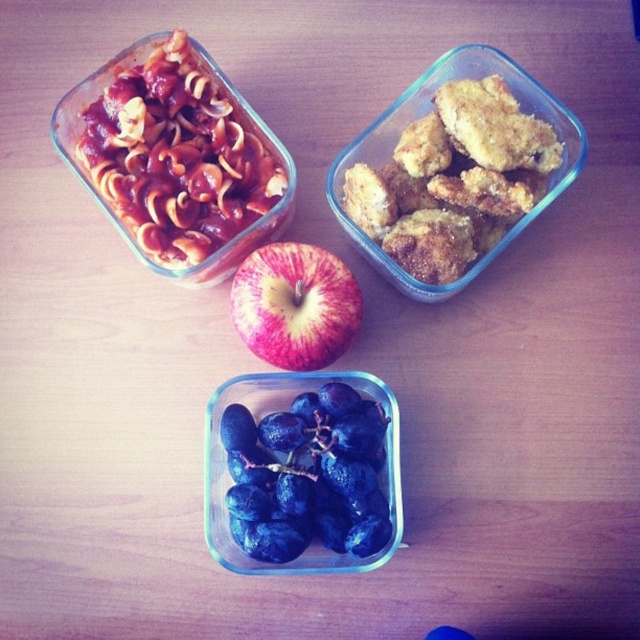
Question: Does crispy golden nuggets at upper right appear over red matte apple at center?

Choices:
 (A) yes
 (B) no

Answer: (A)

Question: Which object is farther from the camera taking this photo?

Choices:
 (A) blue matte grapes at center
 (B) red matte apple at center
 (C) crispy golden nuggets at upper right

Answer: (C)

Question: Which of these objects is positioned farthest from the red matte apple at center?

Choices:
 (A) blue matte grapes at center
 (B) crispy golden nuggets at upper right

Answer: (B)

Question: Is blue matte grapes at center below red matte apple at center?

Choices:
 (A) no
 (B) yes

Answer: (B)

Question: Which object is the farthest from the blue matte grapes at center?

Choices:
 (A) crispy golden nuggets at upper right
 (B) red matte apple at center

Answer: (A)

Question: Does crispy golden nuggets at upper right have a greater width compared to red matte apple at center?

Choices:
 (A) yes
 (B) no

Answer: (A)